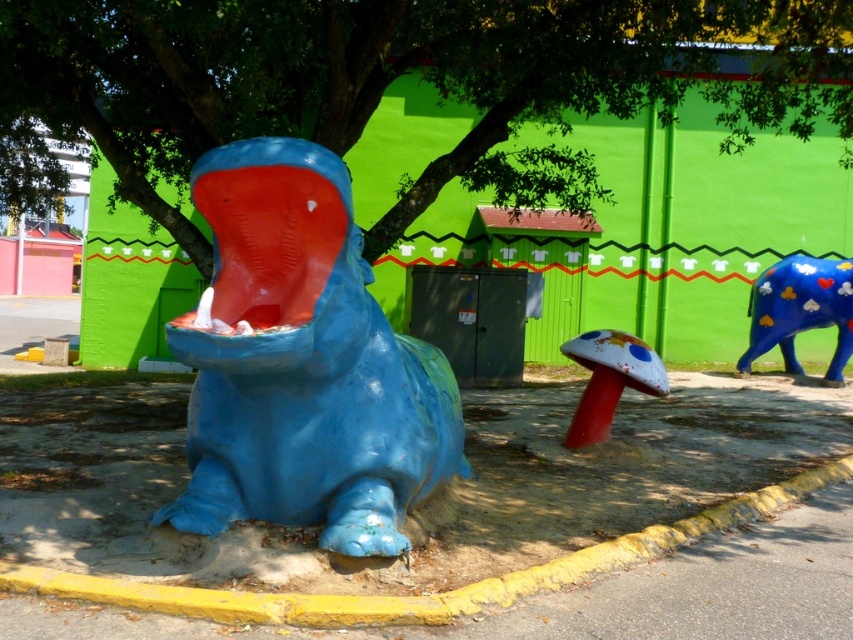
You are standing in front of the blue glossy elephant at right and want to place a small flower pot on the ground. If you look towards the yellow painted curb at lower left, which direction should you walk to place the flower pot closer to the curb?

Since the yellow painted curb at lower left is closer to the viewer than the blue glossy elephant at right, you should walk towards the yellow painted curb at lower left direction to place the flower pot closer to it.

You are standing at the point marked by the coordinates point (422, 595) in the image. What is the nearest object to you?

The nearest object to you is the yellow painted curb at lower left, as the coordinates point (422, 595) indicates its location.